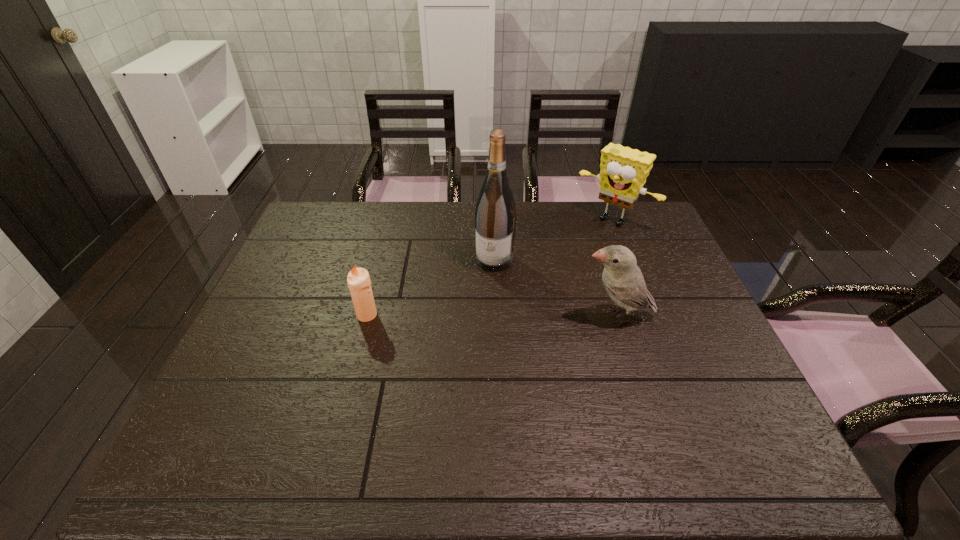
Where is `the shortest object`? The image size is (960, 540). the shortest object is located at coordinates (358, 280).

Locate an element on the screen. The image size is (960, 540). candle is located at coordinates point(358,280).

This screenshot has width=960, height=540. Identify the location of bird. (622, 278).

I want to click on sponge, so click(x=623, y=171).

Image resolution: width=960 pixels, height=540 pixels. Find the location of `the second object from left to right`. the second object from left to right is located at coordinates (495, 215).

Locate an element on the screen. the tallest object is located at coordinates (495, 215).

Find the location of `free point located on the front of the shortest object`. free point located on the front of the shortest object is located at coordinates (361, 337).

This screenshot has width=960, height=540. I want to click on vacant area situated 0.060m at the face of the bird, so click(557, 316).

At what (x,y) coordinates should I click in order to perform the action: click on free location located at the face of the bird. Please return your answer as a coordinate pair (x, y). This screenshot has width=960, height=540. Looking at the image, I should click on (493, 316).

At what (x,y) coordinates should I click in order to perform the action: click on vacant point located 0.060m at the face of the bird. Please return your answer as a coordinate pair (x, y). This screenshot has height=540, width=960. Looking at the image, I should click on (557, 316).